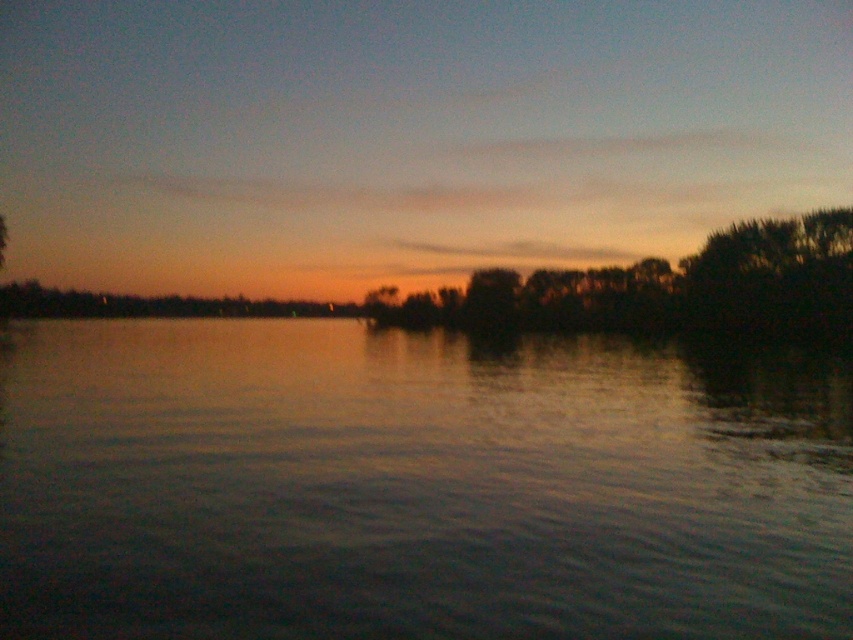
Question: From the image, what is the correct spatial relationship of smooth water at center in relation to dark green leafy tree at right?

Choices:
 (A) above
 (B) below

Answer: (B)

Question: Which point is farther from the camera taking this photo?

Choices:
 (A) (790, 221)
 (B) (816, 218)

Answer: (A)

Question: Is smooth water at center further to the viewer compared to dark green leafy trees at center?

Choices:
 (A) yes
 (B) no

Answer: (B)

Question: Estimate the real-world distances between objects in this image. Which object is closer to the dark green leafy trees at center?

Choices:
 (A) smooth water at center
 (B) dark green leafy tree at right

Answer: (B)

Question: Is smooth water at center closer to the viewer compared to dark green leafy trees at center?

Choices:
 (A) no
 (B) yes

Answer: (B)

Question: Which object is the farthest from the dark green leafy trees at center?

Choices:
 (A) smooth water at center
 (B) dark green leafy tree at right

Answer: (A)